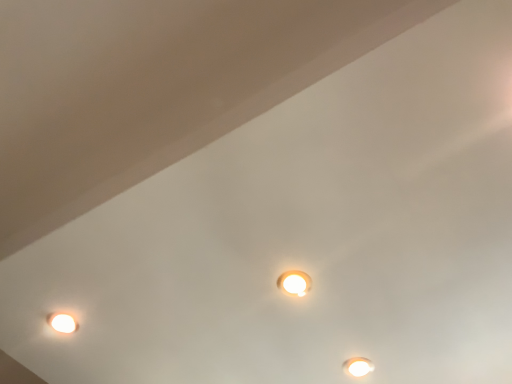
How much space does white glossy lamp at lower right, which ranks as the 2th lamp in front-to-back order, occupy horizontally?

It is 3.33 inches.

Where is `white glossy lamp at lower right, the 1th lamp positioned from the back`? white glossy lamp at lower right, the 1th lamp positioned from the back is located at coordinates (358, 366).

Describe the element at coordinates (358, 366) in the screenshot. I see `white glossy lamp at lower right, which appears as the second lamp when viewed from the left` at that location.

How much space does white glossy lamp at center, which appears as the 1th lamp when viewed from the left, occupy horizontally?

white glossy lamp at center, which appears as the 1th lamp when viewed from the left, is 3.21 inches in width.

The height and width of the screenshot is (384, 512). I want to click on white glossy lamp at center, which is the 1th lamp from top to bottom, so click(x=294, y=282).

What do you see at coordinates (294, 282) in the screenshot?
I see `white glossy lamp at center, which appears as the 1th lamp when viewed from the left` at bounding box center [294, 282].

I want to click on white glossy lamp at lower right, the 1th lamp positioned from the back, so click(x=358, y=366).

Is white glossy lamp at lower right, marked as the 1th lamp in a right-to-left arrangement, at the left side of white glossy lamp at center, which appears as the 1th lamp when viewed from the left?

In fact, white glossy lamp at lower right, marked as the 1th lamp in a right-to-left arrangement, is to the right of white glossy lamp at center, which appears as the 1th lamp when viewed from the left.

Which object is further away from the camera, white glossy lamp at lower right, which appears as the second lamp when viewed from the left, or white glossy lamp at center, which appears as the 1th lamp when viewed from the left?

white glossy lamp at lower right, which appears as the second lamp when viewed from the left, is further from the camera.

Does point (358, 357) come behind point (281, 279)?

Yes, it is.

From the image's perspective, who appears lower, white glossy lamp at lower right, marked as the 1th lamp in a right-to-left arrangement, or white glossy lamp at center, which ranks as the 1th lamp in front-to-back order?

From the image's view, white glossy lamp at lower right, marked as the 1th lamp in a right-to-left arrangement, is below.

From a real-world perspective, between white glossy lamp at lower right, the 1th lamp from the bottom, and white glossy lamp at center, the second lamp from the right, who is vertically higher?

white glossy lamp at lower right, the 1th lamp from the bottom.

Which of these two, white glossy lamp at lower right, which ranks as the 2th lamp in front-to-back order, or white glossy lamp at center, which ranks as the 1th lamp in front-to-back order, is wider?

With larger width is white glossy lamp at lower right, which ranks as the 2th lamp in front-to-back order.

Can you confirm if white glossy lamp at lower right, the 1th lamp positioned from the back, is taller than white glossy lamp at center, which is the 1th lamp from top to bottom?

Indeed, white glossy lamp at lower right, the 1th lamp positioned from the back, has a greater height compared to white glossy lamp at center, which is the 1th lamp from top to bottom.

In terms of size, does white glossy lamp at lower right, the 1th lamp from the bottom, appear bigger or smaller than white glossy lamp at center, which ranks as the 1th lamp in front-to-back order?

In the image, white glossy lamp at lower right, the 1th lamp from the bottom, appears to be larger than white glossy lamp at center, which ranks as the 1th lamp in front-to-back order.

Do you think white glossy lamp at lower right, marked as the 1th lamp in a right-to-left arrangement, is within white glossy lamp at center, which ranks as the 1th lamp in front-to-back order, or outside of it?

white glossy lamp at lower right, marked as the 1th lamp in a right-to-left arrangement, is located beyond the bounds of white glossy lamp at center, which ranks as the 1th lamp in front-to-back order.

Is white glossy lamp at lower right, acting as the second lamp starting from the top, positioned far away from white glossy lamp at center, the second lamp from the right?

No, there isn't a large distance between white glossy lamp at lower right, acting as the second lamp starting from the top, and white glossy lamp at center, the second lamp from the right.

Does white glossy lamp at lower right, which appears as the second lamp when viewed from the left, turn towards white glossy lamp at center, the second lamp from the right?

Yes, white glossy lamp at lower right, which appears as the second lamp when viewed from the left, is oriented towards white glossy lamp at center, the second lamp from the right.

Identify the location of lamp that is behind the white glossy lamp at center, which ranks as the 1th lamp in front-to-back order. (358, 366).

Is white glossy lamp at center, which appears as the 1th lamp when viewed from the left, to the left of white glossy lamp at lower right, which ranks as the 2th lamp in front-to-back order, from the viewer's perspective?

Indeed, white glossy lamp at center, which appears as the 1th lamp when viewed from the left, is positioned on the left side of white glossy lamp at lower right, which ranks as the 2th lamp in front-to-back order.

Is white glossy lamp at center, the second lamp from the right, closer to the viewer compared to white glossy lamp at lower right, the 1th lamp positioned from the back?

Yes, the depth of white glossy lamp at center, the second lamp from the right, is less than that of white glossy lamp at lower right, the 1th lamp positioned from the back.

Does point (282, 285) come closer to viewer compared to point (373, 366)?

Yes, it is.

From the image's perspective, would you say white glossy lamp at center, which appears as the 1th lamp when viewed from the left, is positioned over white glossy lamp at lower right, the 1th lamp positioned from the back?

Indeed, from the image's perspective, white glossy lamp at center, which appears as the 1th lamp when viewed from the left, is shown above white glossy lamp at lower right, the 1th lamp positioned from the back.

From a real-world perspective, is white glossy lamp at center, the second lamp from the right, beneath white glossy lamp at lower right, the 1th lamp from the bottom?

Yes, from a real-world perspective, white glossy lamp at center, the second lamp from the right, is below white glossy lamp at lower right, the 1th lamp from the bottom.

Considering the relative sizes of white glossy lamp at center, the second lamp from the right, and white glossy lamp at lower right, acting as the second lamp starting from the top, in the image provided, is white glossy lamp at center, the second lamp from the right, thinner than white glossy lamp at lower right, acting as the second lamp starting from the top,?

Correct, the width of white glossy lamp at center, the second lamp from the right, is less than that of white glossy lamp at lower right, acting as the second lamp starting from the top.

Considering the sizes of white glossy lamp at center, which ranks as the 1th lamp in front-to-back order, and white glossy lamp at lower right, the 1th lamp from the bottom, in the image, is white glossy lamp at center, which ranks as the 1th lamp in front-to-back order, taller or shorter than white glossy lamp at lower right, the 1th lamp from the bottom,?

In the image, white glossy lamp at center, which ranks as the 1th lamp in front-to-back order, appears to be shorter than white glossy lamp at lower right, the 1th lamp from the bottom.

Is white glossy lamp at center, which ranks as the 1th lamp in front-to-back order, smaller than white glossy lamp at lower right, the 1th lamp positioned from the back?

Yes.

Is white glossy lamp at center, which appears as the second lamp when viewed from the back, completely or partially outside of white glossy lamp at lower right, the 1th lamp positioned from the back?

Yes, white glossy lamp at center, which appears as the second lamp when viewed from the back, is outside of white glossy lamp at lower right, the 1th lamp positioned from the back.

Is white glossy lamp at center, which is the 1th lamp from top to bottom, directly adjacent to white glossy lamp at lower right, acting as the second lamp starting from the top?

No.

Could you tell me if white glossy lamp at center, the second lamp from the bottom, is turned towards white glossy lamp at lower right, acting as the second lamp starting from the top?

Yes.

How far apart are white glossy lamp at center, the second lamp from the bottom, and white glossy lamp at lower right, the 1th lamp positioned from the back?

white glossy lamp at center, the second lamp from the bottom, and white glossy lamp at lower right, the 1th lamp positioned from the back, are 13.21 inches apart.

Locate an element on the screen. lamp on the left of white glossy lamp at lower right, acting as the second lamp starting from the top is located at coordinates (294, 282).

Where is `lamp on the left of white glossy lamp at lower right, the 1th lamp positioned from the back`? The image size is (512, 384). lamp on the left of white glossy lamp at lower right, the 1th lamp positioned from the back is located at coordinates (294, 282).

Image resolution: width=512 pixels, height=384 pixels. Find the location of `lamp below the white glossy lamp at center, which ranks as the 1th lamp in front-to-back order (from the image's perspective)`. lamp below the white glossy lamp at center, which ranks as the 1th lamp in front-to-back order (from the image's perspective) is located at coordinates (358, 366).